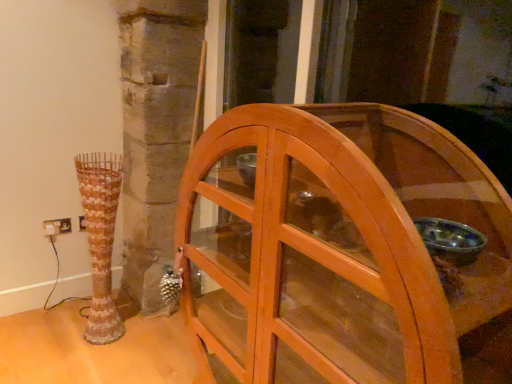
What do you see at coordinates (100, 239) in the screenshot? I see `rustic ceramic vase at left` at bounding box center [100, 239].

This screenshot has width=512, height=384. I want to click on wooden cabinet at center, so click(344, 252).

Locate an element on the screen. This screenshot has height=384, width=512. white plastic electric outlet at lower left is located at coordinates coord(57,226).

Is rustic ceramic vase at left far from white plastic electric outlet at lower left?

No, rustic ceramic vase at left is not far away from white plastic electric outlet at lower left.

Is rustic ceramic vase at left inside the boundaries of white plastic electric outlet at lower left, or outside?

The correct answer is: outside.

From their relative heights in the image, would you say rustic ceramic vase at left is taller or shorter than white plastic electric outlet at lower left?

Answer: rustic ceramic vase at left is taller than white plastic electric outlet at lower left.

Is white plastic electric outlet at lower left beside wooden cabinet at center?

No.

From the image's perspective, between white plastic electric outlet at lower left and wooden cabinet at center, who is located below?

wooden cabinet at center is shown below in the image.

Which object is more forward, white plastic electric outlet at lower left or wooden cabinet at center?

wooden cabinet at center is more forward.

Is white plastic electric outlet at lower left to the left of wooden cabinet at center from the viewer's perspective?

Yes.

In the image, is wooden cabinet at center on the left side or the right side of white plastic electric outlet at lower left?

In the image, wooden cabinet at center appears on the right side of white plastic electric outlet at lower left.

Is wooden cabinet at center wider or thinner than white plastic electric outlet at lower left?

Considering their sizes, wooden cabinet at center looks broader than white plastic electric outlet at lower left.

Is white plastic electric outlet at lower left at the back of wooden cabinet at center?

No, wooden cabinet at center is not facing away from white plastic electric outlet at lower left.

At what (x,y) coordinates should I click in order to perform the action: click on electric outlet directly beneath the wooden cabinet at center (from a real-world perspective). Please return your answer as a coordinate pair (x, y). The height and width of the screenshot is (384, 512). Looking at the image, I should click on (57, 226).

Based on the photo, from the image's perspective, which one is positioned higher, rustic ceramic vase at left or wooden cabinet at center?

From the image's view, rustic ceramic vase at left is above.

Is rustic ceramic vase at left next to wooden cabinet at center and touching it?

There is a gap between rustic ceramic vase at left and wooden cabinet at center.

From the picture: Measure the distance from rustic ceramic vase at left to wooden cabinet at center.

rustic ceramic vase at left is 3.62 feet away from wooden cabinet at center.

Is rustic ceramic vase at left at the left side of wooden cabinet at center?

Yes, rustic ceramic vase at left is to the left of wooden cabinet at center.

Identify the location of vase lying below the white plastic electric outlet at lower left (from the image's perspective). Image resolution: width=512 pixels, height=384 pixels. (100, 239).

Considering the sizes of white plastic electric outlet at lower left and rustic ceramic vase at left in the image, is white plastic electric outlet at lower left bigger or smaller than rustic ceramic vase at left?

In the image, white plastic electric outlet at lower left appears to be smaller than rustic ceramic vase at left.

Can you confirm if white plastic electric outlet at lower left is wider than rustic ceramic vase at left?

In fact, white plastic electric outlet at lower left might be narrower than rustic ceramic vase at left.

From the image's perspective, between wooden cabinet at center and rustic ceramic vase at left, who is located below?

wooden cabinet at center is shown below in the image.

Can you confirm if wooden cabinet at center is bigger than rustic ceramic vase at left?

Yes.

Based on the photo, from a real-world perspective, between wooden cabinet at center and rustic ceramic vase at left, who is vertically lower?

From a 3D spatial view, rustic ceramic vase at left is below.

Based on the photo, is wooden cabinet at center positioned behind rustic ceramic vase at left?

No, wooden cabinet at center is in front of rustic ceramic vase at left.

Locate an element on the screen. vase on the right of white plastic electric outlet at lower left is located at coordinates (100, 239).

Image resolution: width=512 pixels, height=384 pixels. I want to click on electric outlet located underneath the wooden cabinet at center (from a real-world perspective), so click(57, 226).

Estimate the real-world distances between objects in this image. Which object is closer to rustic ceramic vase at left, white plastic electric outlet at lower left or wooden cabinet at center?

white plastic electric outlet at lower left lies closer to rustic ceramic vase at left than the other object.

When comparing their distances from wooden cabinet at center, does white plastic electric outlet at lower left or rustic ceramic vase at left seem further?

white plastic electric outlet at lower left.

Based on their spatial positions, is wooden cabinet at center or white plastic electric outlet at lower left closer to rustic ceramic vase at left?

white plastic electric outlet at lower left.

Which object lies further to the anchor point wooden cabinet at center, rustic ceramic vase at left or white plastic electric outlet at lower left?

white plastic electric outlet at lower left lies further to wooden cabinet at center than the other object.

When comparing their distances from white plastic electric outlet at lower left, does rustic ceramic vase at left or wooden cabinet at center seem further?

wooden cabinet at center.

Which object lies further to the anchor point white plastic electric outlet at lower left, wooden cabinet at center or rustic ceramic vase at left?

The object further to white plastic electric outlet at lower left is wooden cabinet at center.

This screenshot has height=384, width=512. In order to click on vase between wooden cabinet at center and white plastic electric outlet at lower left in the front-back direction in this screenshot , I will do `click(100, 239)`.